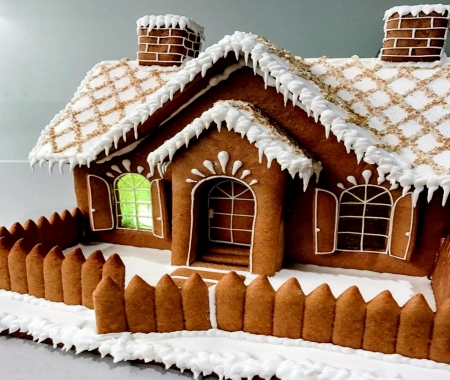
Locate an element on the screen. This screenshot has height=380, width=450. door handle is located at coordinates (211, 213).